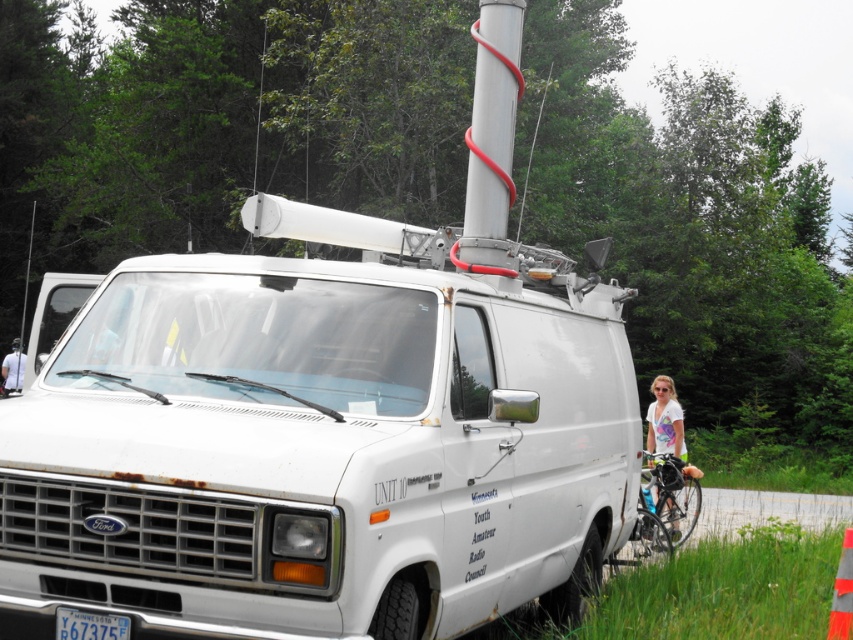
Which is in front, point (688, 500) or point (672, 442)?

Point (672, 442) is in front.

Between point (635, 531) and point (668, 442), which one is positioned in front?

Point (635, 531) is more forward.

Where is `shiny black bicycle at right`? This screenshot has height=640, width=853. shiny black bicycle at right is located at coordinates (660, 513).

Is shiny black bicycle at right wider than yellow matte license plate at lower center?

Yes, shiny black bicycle at right is wider than yellow matte license plate at lower center.

Is point (695, 486) behind point (73, 634)?

Yes, point (695, 486) is farther from viewer.

The height and width of the screenshot is (640, 853). Find the location of `shiny black bicycle at right`. shiny black bicycle at right is located at coordinates (660, 513).

Is shiny black bicycle at right in front of orange fabric cone at center?

No, shiny black bicycle at right is behind orange fabric cone at center.

Does shiny black bicycle at right appear under orange fabric cone at center?

Correct, shiny black bicycle at right is located below orange fabric cone at center.

Which is in front, point (630, 532) or point (834, 625)?

Point (834, 625)

In order to click on shiny black bicycle at right in this screenshot , I will do `click(660, 513)`.